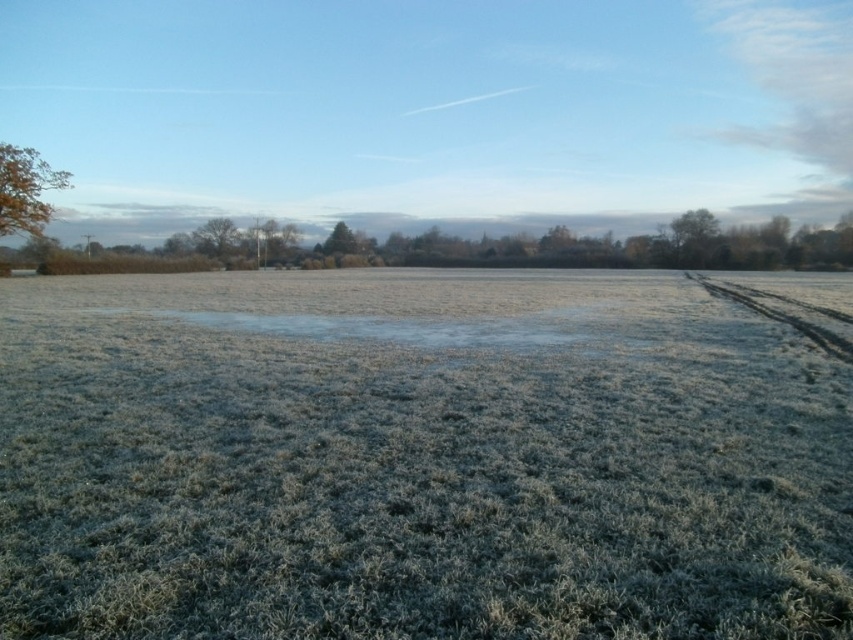
Question: Considering the relative positions of green matte tree at upper right and green textured tree at center in the image provided, where is green matte tree at upper right located with respect to green textured tree at center?

Choices:
 (A) below
 (B) above

Answer: (A)

Question: Which of these objects is positioned closest to the brown textured tree at center?

Choices:
 (A) green matte tree at upper right
 (B) frosted grass at center
 (C) green textured tree at center

Answer: (C)

Question: Can you confirm if golden brown leaves at upper left is bigger than green textured tree at center?

Choices:
 (A) no
 (B) yes

Answer: (A)

Question: Which point appears closest to the camera in this image?

Choices:
 (A) (221, 224)
 (B) (0, 211)
 (C) (699, 244)
 (D) (474, 573)

Answer: (D)

Question: Which point is farther to the camera?

Choices:
 (A) (689, 252)
 (B) (39, 234)
 (C) (541, 579)
 (D) (346, 252)

Answer: (D)

Question: Does frosted grass at center have a smaller size compared to brown textured tree at center?

Choices:
 (A) yes
 (B) no

Answer: (B)